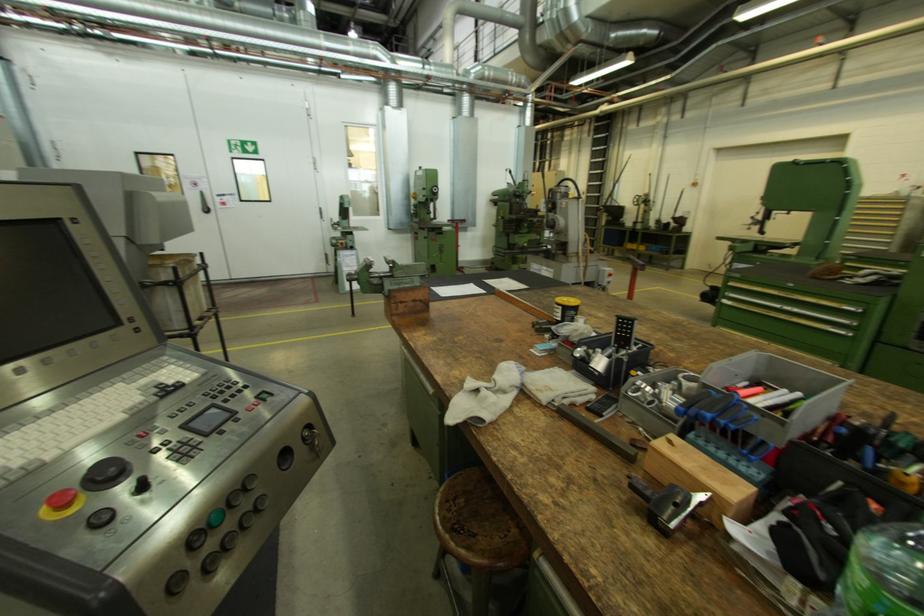
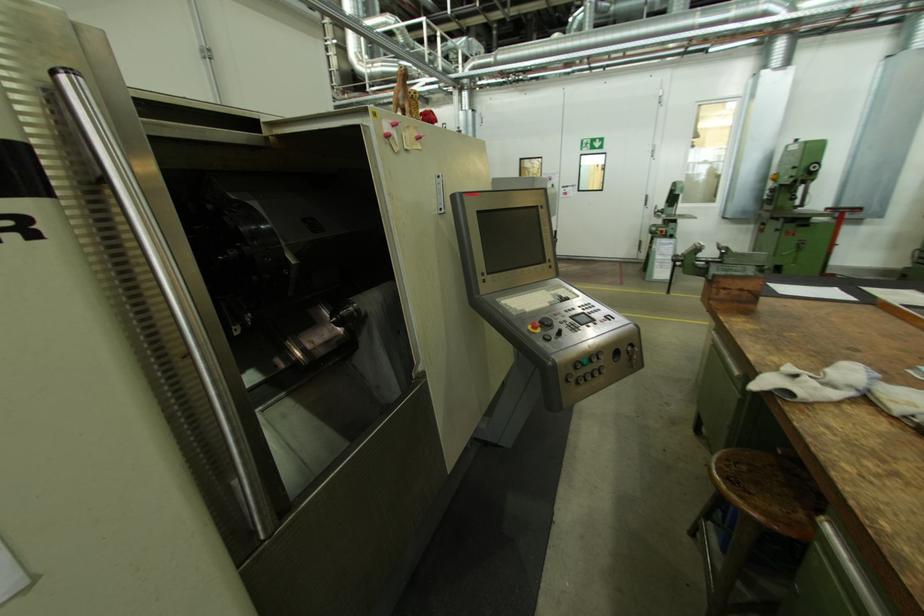
Locate, in the second image, the point that corresponds to point 50,514 in the first image.

(535, 329)